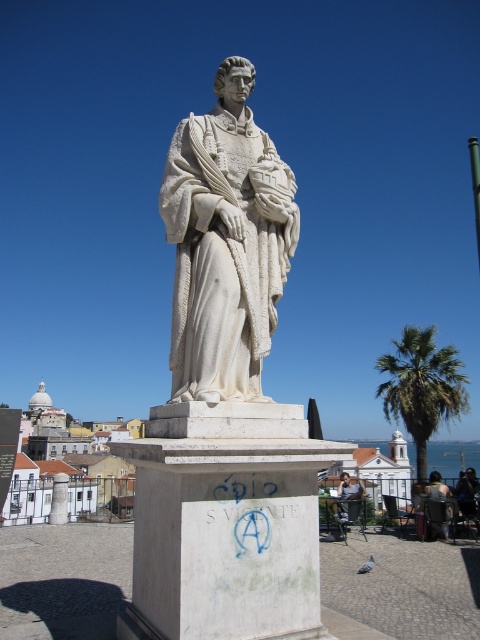
Question: Does white marble statue at center appear on the right side of dark brown leather jacket at lower right?

Choices:
 (A) no
 (B) yes

Answer: (A)

Question: Which is farther from the green leafy palm tree at right?

Choices:
 (A) white marble statue at center
 (B) dark blue fabric at lower right
 (C) light brown wooden chair at lower right
 (D) dark brown leather jacket at lower right

Answer: (A)

Question: In this image, where is white marble statue at center located relative to dark brown leather jacket at lower right?

Choices:
 (A) right
 (B) left

Answer: (B)

Question: Is green leafy palm tree at right thinner than light brown wooden chair at lower right?

Choices:
 (A) yes
 (B) no

Answer: (B)

Question: Which point appears closest to the camera in this image?

Choices:
 (A) (337, 506)
 (B) (271, 260)
 (C) (436, 524)
 (D) (466, 502)

Answer: (B)

Question: Estimate the real-world distances between objects in this image. Which object is closer to the white marble statue at center?

Choices:
 (A) green leafy palm tree at right
 (B) light brown wooden chair at lower right
 (C) dark blue fabric at lower right

Answer: (B)